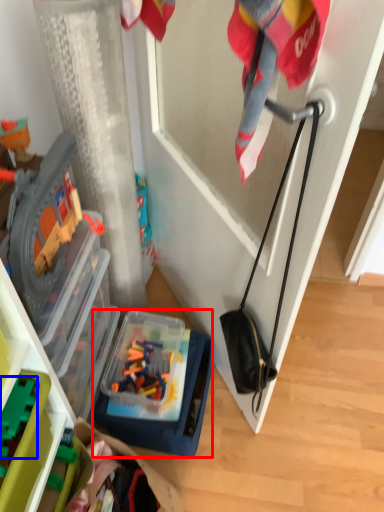
Question: Which point is closer to the camera, box (highlighted by a red box) or toy (highlighted by a blue box)?

Choices:
 (A) box
 (B) toy

Answer: (B)